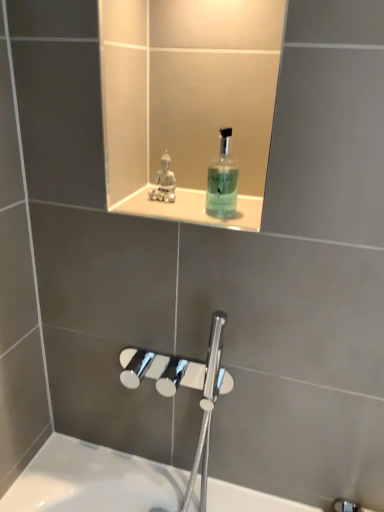
Identify the location of satin silver statue at upper center. The width and height of the screenshot is (384, 512). (164, 182).

Find the location of a particular element. This screenshot has height=512, width=384. white glossy ledge at upper center is located at coordinates (192, 208).

Where is `satin silver statue at upper center`? This screenshot has height=512, width=384. satin silver statue at upper center is located at coordinates (164, 182).

Based on the photo, is translucent glass mouthwash at upper center beside white glossy ledge at upper center?

Yes, translucent glass mouthwash at upper center is right next to white glossy ledge at upper center and making contact.

Between translucent glass mouthwash at upper center and white glossy ledge at upper center, which one has larger size?

translucent glass mouthwash at upper center.

Is the position of translucent glass mouthwash at upper center more distant than that of white glossy ledge at upper center?

No, it is not.

From the image's perspective, which is above, translucent glass mouthwash at upper center or white glossy ledge at upper center?

translucent glass mouthwash at upper center is shown above in the image.

From a real-world perspective, is satin silver statue at upper center physically above translucent glass mouthwash at upper center?

No, from a real-world perspective, satin silver statue at upper center is not over translucent glass mouthwash at upper center

Which of these two, satin silver statue at upper center or translucent glass mouthwash at upper center, is smaller?

satin silver statue at upper center is smaller.

Can translucent glass mouthwash at upper center be found inside satin silver statue at upper center?

No, translucent glass mouthwash at upper center is located outside of satin silver statue at upper center.

Is point (158, 180) more distant than point (220, 167)?

No, it is in front of (220, 167).

Based on the photo, which object is more forward, white glossy ledge at upper center or satin silver statue at upper center?

white glossy ledge at upper center.

Is white glossy ledge at upper center inside the boundaries of satin silver statue at upper center, or outside?

white glossy ledge at upper center is located beyond the bounds of satin silver statue at upper center.

From the image's perspective, is white glossy ledge at upper center above satin silver statue at upper center?

No, from the image's perspective, white glossy ledge at upper center is not above satin silver statue at upper center.

Between white glossy ledge at upper center and satin silver statue at upper center, which one has more height?

satin silver statue at upper center is taller.

Does white glossy ledge at upper center have a larger size compared to translucent glass mouthwash at upper center?

No, white glossy ledge at upper center is not bigger than translucent glass mouthwash at upper center.

From a real-world perspective, is white glossy ledge at upper center above or below translucent glass mouthwash at upper center?

white glossy ledge at upper center is below translucent glass mouthwash at upper center.

Is white glossy ledge at upper center turned away from translucent glass mouthwash at upper center?

No.

From the picture: Can you tell me how much white glossy ledge at upper center and translucent glass mouthwash at upper center differ in facing direction?

There is a 0.158-degree angle between the facing directions of white glossy ledge at upper center and translucent glass mouthwash at upper center.

From the image's perspective, which one is positioned higher, translucent glass mouthwash at upper center or satin silver statue at upper center?

satin silver statue at upper center is shown above in the image.

This screenshot has width=384, height=512. I want to click on mouthwash that appears in front of the satin silver statue at upper center, so click(222, 181).

Is translucent glass mouthwash at upper center in front of or behind satin silver statue at upper center in the image?

Visually, translucent glass mouthwash at upper center is located in front of satin silver statue at upper center.

Between point (223, 177) and point (161, 166), which one is positioned behind?

The point (223, 177) is behind.

Would you say white glossy ledge at upper center is part of satin silver statue at upper center's contents?

Definitely not — white glossy ledge at upper center is not inside satin silver statue at upper center.

Which is in front, satin silver statue at upper center or white glossy ledge at upper center?

Positioned in front is white glossy ledge at upper center.

Is white glossy ledge at upper center at the back of satin silver statue at upper center?

That's not correct — satin silver statue at upper center is not looking away from white glossy ledge at upper center.

How distant is satin silver statue at upper center from white glossy ledge at upper center?

A distance of 3.01 inches exists between satin silver statue at upper center and white glossy ledge at upper center.

In order to click on mouthwash above the white glossy ledge at upper center (from the image's perspective) in this screenshot , I will do `click(222, 181)`.

Find the location of a particular element. This screenshot has width=384, height=512. perfume lying behind the translucent glass mouthwash at upper center is located at coordinates (164, 182).

From the image, which object appears to be nearer to translucent glass mouthwash at upper center, satin silver statue at upper center or white glossy ledge at upper center?

white glossy ledge at upper center lies closer to translucent glass mouthwash at upper center than the other object.

Consider the image. From the image, which object appears to be farther from translucent glass mouthwash at upper center, white glossy ledge at upper center or satin silver statue at upper center?

satin silver statue at upper center is positioned further to the anchor translucent glass mouthwash at upper center.

Based on their spatial positions, is translucent glass mouthwash at upper center or satin silver statue at upper center further from white glossy ledge at upper center?

satin silver statue at upper center.

Estimate the real-world distances between objects in this image. Which object is further from satin silver statue at upper center, translucent glass mouthwash at upper center or white glossy ledge at upper center?

Based on the image, translucent glass mouthwash at upper center appears to be further to satin silver statue at upper center.

From the image, which object appears to be nearer to white glossy ledge at upper center, satin silver statue at upper center or translucent glass mouthwash at upper center?

translucent glass mouthwash at upper center is closer to white glossy ledge at upper center.

Looking at the image, which one is located closer to satin silver statue at upper center, white glossy ledge at upper center or translucent glass mouthwash at upper center?

white glossy ledge at upper center is positioned closer to the anchor satin silver statue at upper center.

The width and height of the screenshot is (384, 512). I want to click on ledge between translucent glass mouthwash at upper center and satin silver statue at upper center in the front-back direction, so click(x=192, y=208).